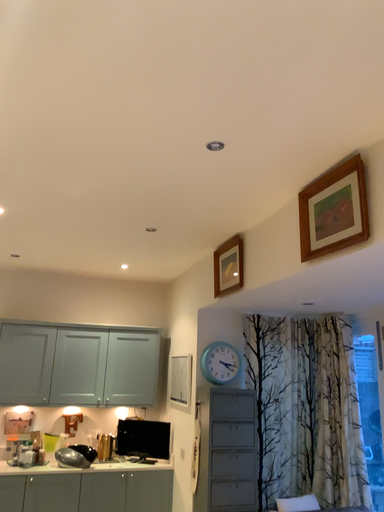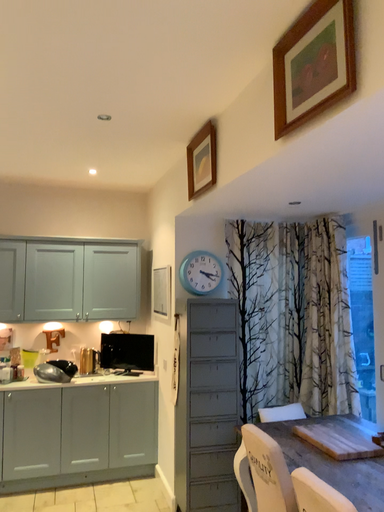
Question: Which way did the camera rotate in the video?

Choices:
 (A) rotated upward
 (B) rotated downward

Answer: (B)